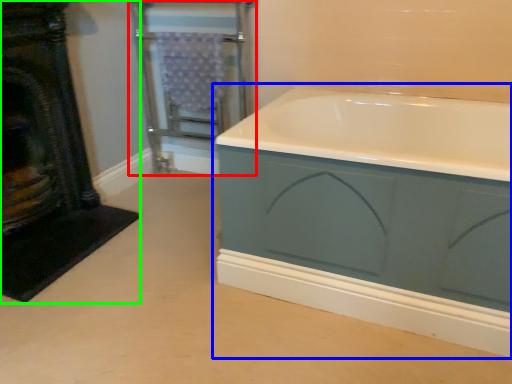
Question: Based on their relative distances, which object is farther from screen door (highlighted by a red box)? Choose from bathtub (highlighted by a blue box) and fireplace (highlighted by a green box).

Choices:
 (A) bathtub
 (B) fireplace

Answer: (A)